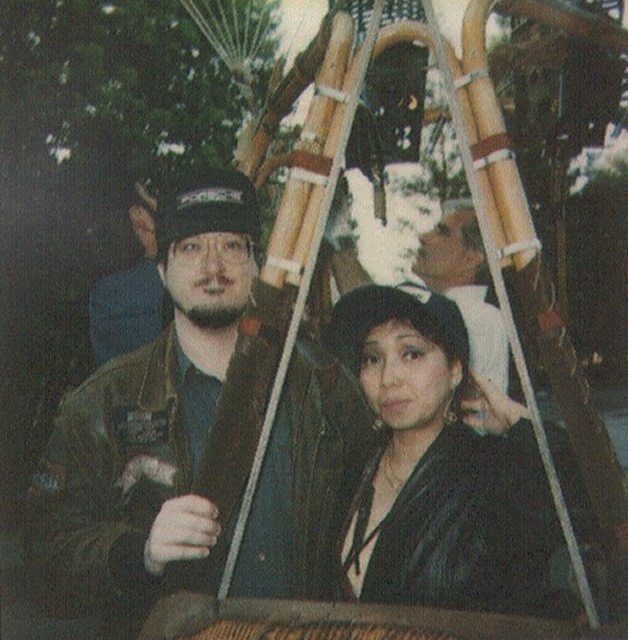
Does black leather jacket at center have a greater width compared to matte black jacket at left?

No, black leather jacket at center is not wider than matte black jacket at left.

Is black leather jacket at center bigger than matte black jacket at left?

Actually, black leather jacket at center might be smaller than matte black jacket at left.

Between point (452, 353) and point (154, 212), which one is positioned in front?

Point (452, 353) is in front.

Locate an element on the screen. black leather jacket at center is located at coordinates (436, 468).

At what (x,y) coordinates should I click in order to perform the action: click on black leather jacket at center. Please return your answer as a coordinate pair (x, y). Looking at the image, I should click on (436, 468).

Is point (502, 454) in front of point (460, 212)?

Yes, point (502, 454) is in front of point (460, 212).

Where is `black leather jacket at center`? Image resolution: width=628 pixels, height=640 pixels. black leather jacket at center is located at coordinates (436, 468).

Between green matte jacket at center and black leather jacket at center, which one appears on the left side from the viewer's perspective?

Positioned to the left is green matte jacket at center.

Where is `green matte jacket at center`? Image resolution: width=628 pixels, height=640 pixels. green matte jacket at center is located at coordinates (149, 420).

Does point (109, 468) come farther from viewer compared to point (371, 548)?

Yes, it is.

Locate an element on the screen. This screenshot has width=628, height=640. green matte jacket at center is located at coordinates (149, 420).